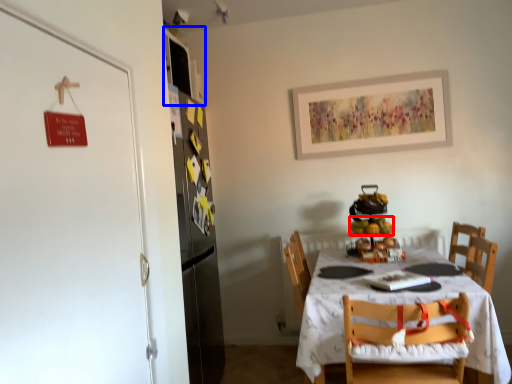
Question: Which point is closer to the camera, fruit (highlighted by a red box) or cabinetry (highlighted by a blue box)?

Choices:
 (A) fruit
 (B) cabinetry

Answer: (A)